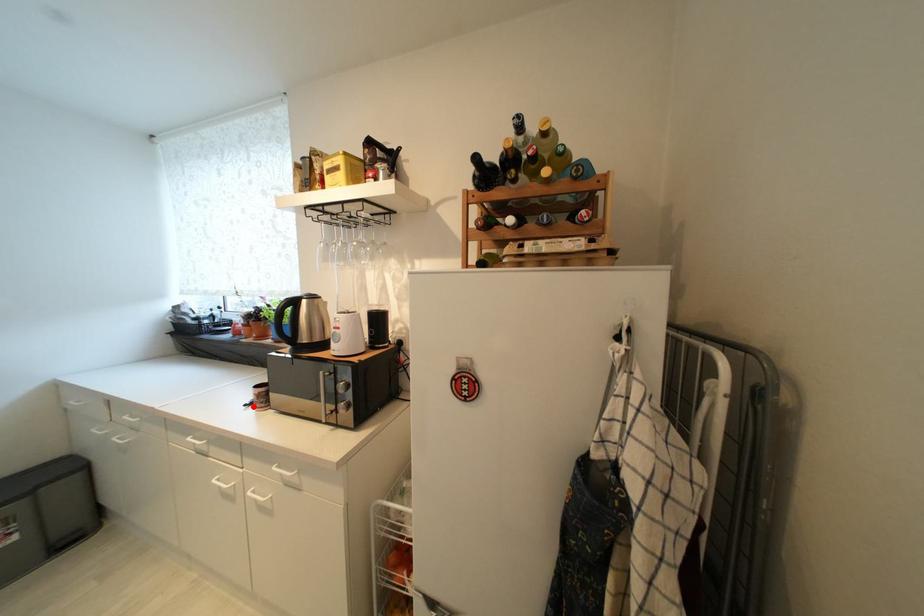
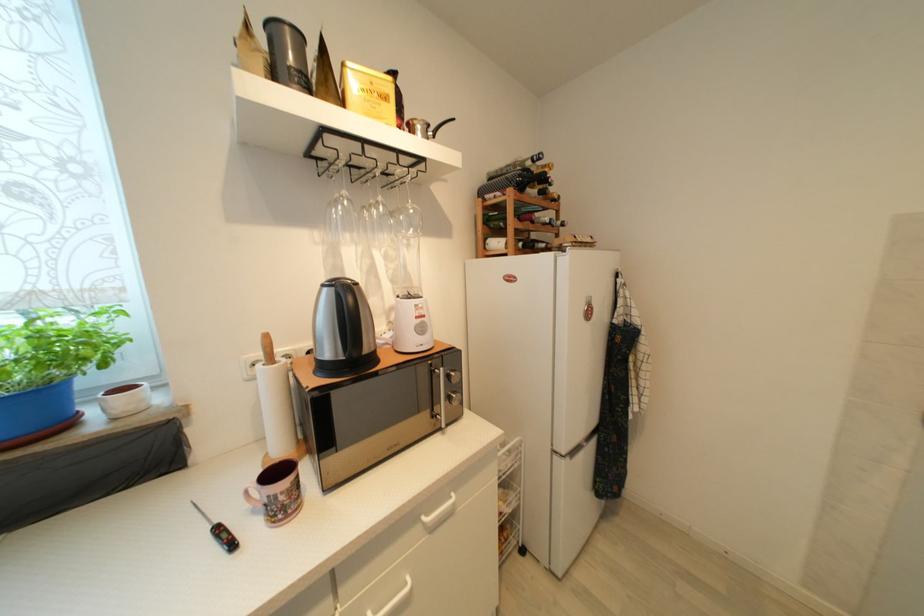
Where in the second image is the point corresponding to the highlighted location from the first image?

(237, 546)